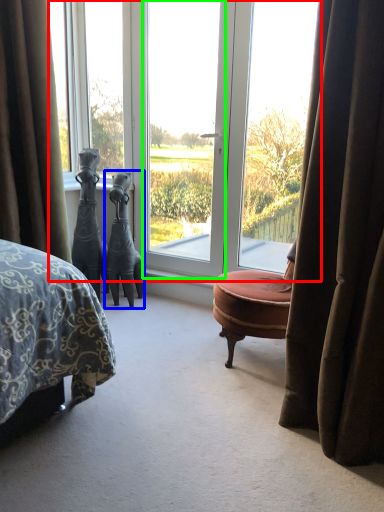
Question: Which object is the closest to the window (highlighted by a red box)? Choose among these: sculpture (highlighted by a blue box) or screen door (highlighted by a green box).

Choices:
 (A) sculpture
 (B) screen door

Answer: (B)